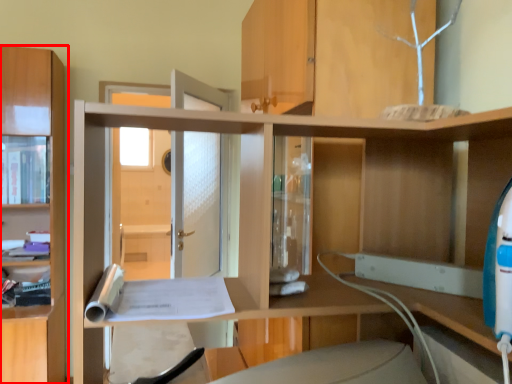
Question: From the image's perspective, considering the relative positions of cabinetry (annotated by the red box) and cabinet in the image provided, where is cabinetry (annotated by the red box) located with respect to the staircase?

Choices:
 (A) below
 (B) above

Answer: (A)